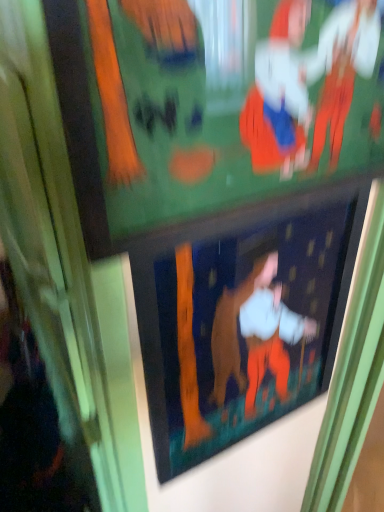
Question: Does matte green bulletin board at upper center have a lesser width compared to matte black picture frame at center?

Choices:
 (A) yes
 (B) no

Answer: (B)

Question: Is the position of matte green bulletin board at upper center less distant than that of matte black picture frame at center?

Choices:
 (A) yes
 (B) no

Answer: (A)

Question: Is matte green bulletin board at upper center further to the viewer compared to matte black picture frame at center?

Choices:
 (A) yes
 (B) no

Answer: (B)

Question: Can you see matte green bulletin board at upper center touching matte black picture frame at center?

Choices:
 (A) no
 (B) yes

Answer: (A)

Question: Considering the relative positions of matte green bulletin board at upper center and matte black picture frame at center in the image provided, is matte green bulletin board at upper center to the right of matte black picture frame at center from the viewer's perspective?

Choices:
 (A) yes
 (B) no

Answer: (B)

Question: From the image's perspective, is matte green bulletin board at upper center over matte black picture frame at center?

Choices:
 (A) yes
 (B) no

Answer: (A)

Question: Is matte black picture frame at center further to camera compared to matte green bulletin board at upper center?

Choices:
 (A) no
 (B) yes

Answer: (B)

Question: Is matte green bulletin board at upper center completely or partially inside matte black picture frame at center?

Choices:
 (A) yes
 (B) no

Answer: (B)

Question: Considering the relative sizes of matte black picture frame at center and matte green bulletin board at upper center in the image provided, is matte black picture frame at center smaller than matte green bulletin board at upper center?

Choices:
 (A) no
 (B) yes

Answer: (B)

Question: Can you confirm if matte black picture frame at center is thinner than matte green bulletin board at upper center?

Choices:
 (A) yes
 (B) no

Answer: (A)

Question: Is matte black picture frame at center far away from matte green bulletin board at upper center?

Choices:
 (A) yes
 (B) no

Answer: (B)

Question: Does matte black picture frame at center have a lesser height compared to matte green bulletin board at upper center?

Choices:
 (A) yes
 (B) no

Answer: (B)

Question: Considering their positions, is matte green bulletin board at upper center located in front of or behind matte black picture frame at center?

Choices:
 (A) behind
 (B) front

Answer: (B)